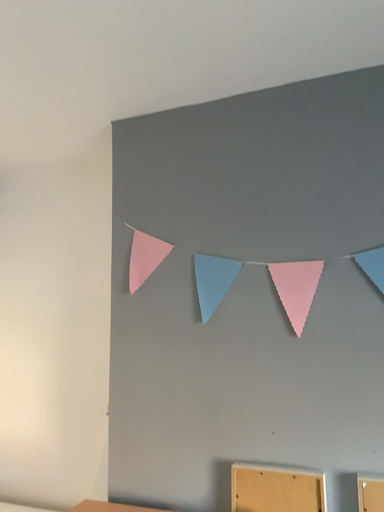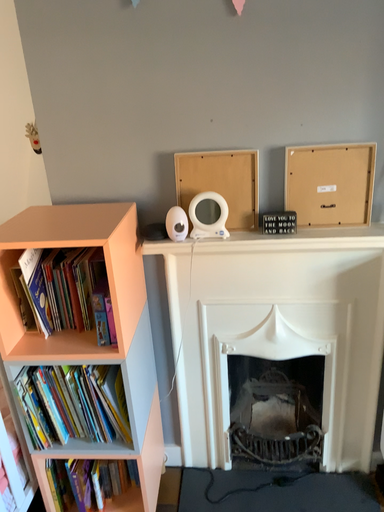
Question: Which way did the camera rotate in the video?

Choices:
 (A) rotated downward
 (B) rotated upward

Answer: (A)